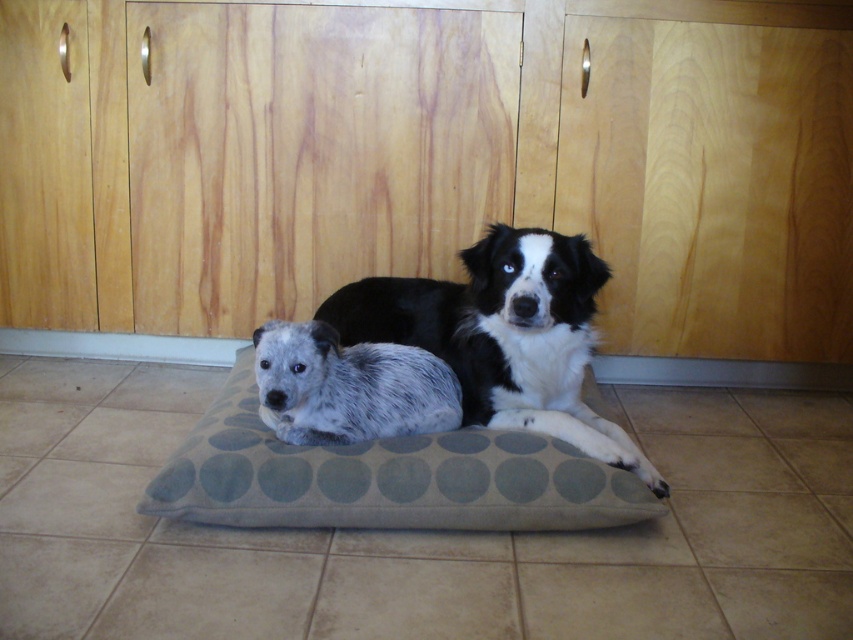
Question: Which point is farther to the camera?

Choices:
 (A) (306, 406)
 (B) (561, 253)
 (C) (492, 472)

Answer: (B)

Question: Estimate the real-world distances between objects in this image. Which object is farther from the spotted fur dog at center?

Choices:
 (A) gray dotted fabric dog bed at center
 (B) black and white fur dog at center

Answer: (B)

Question: Observing the image, what is the correct spatial positioning of black and white fur dog at center in reference to spotted fur dog at center?

Choices:
 (A) left
 (B) right

Answer: (B)

Question: Is gray dotted fabric dog bed at center smaller than black and white fur dog at center?

Choices:
 (A) no
 (B) yes

Answer: (B)

Question: Does gray dotted fabric dog bed at center have a smaller size compared to spotted fur dog at center?

Choices:
 (A) no
 (B) yes

Answer: (A)

Question: Which point is closer to the camera?

Choices:
 (A) coord(486,321)
 (B) coord(244,497)
 (C) coord(412,428)

Answer: (B)